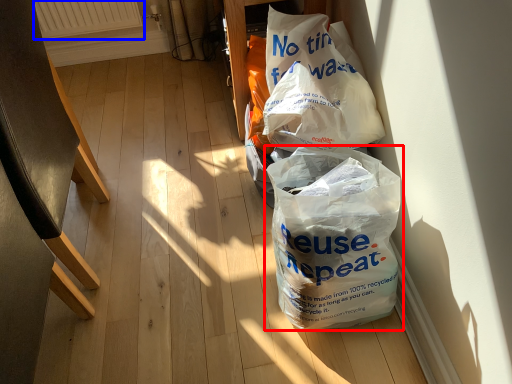
Question: Which object appears closest to the camera in this image, plastic bag (highlighted by a red box) or radiator (highlighted by a blue box)?

Choices:
 (A) plastic bag
 (B) radiator

Answer: (A)